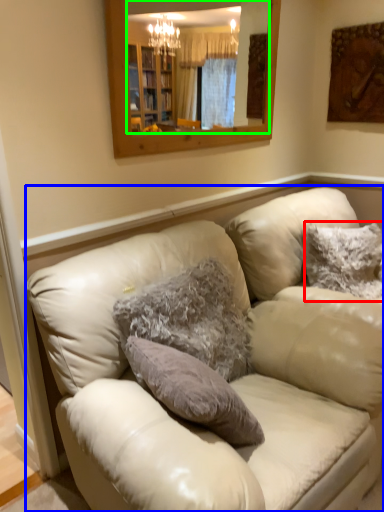
Question: Which object is positioned closest to pillow (highlighted by a red box)? Select from studio couch (highlighted by a blue box) and mirror (highlighted by a green box).

Choices:
 (A) studio couch
 (B) mirror

Answer: (A)